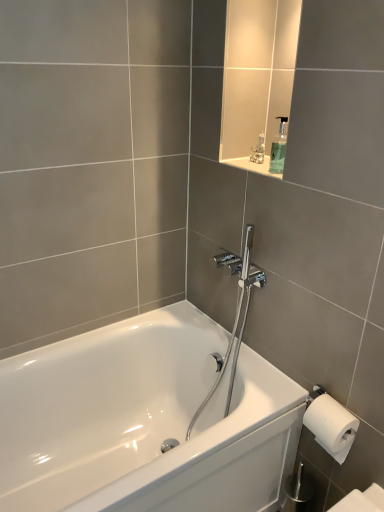
Image resolution: width=384 pixels, height=512 pixels. What do you see at coordinates (144, 421) in the screenshot?
I see `white glossy bathtub at center` at bounding box center [144, 421].

The image size is (384, 512). What do you see at coordinates (258, 150) in the screenshot?
I see `metallic silver figurine at upper center` at bounding box center [258, 150].

Where is `metallic silver figurine at upper center`? Image resolution: width=384 pixels, height=512 pixels. metallic silver figurine at upper center is located at coordinates (258, 150).

Locate an element on the screen. This screenshot has height=512, width=384. transparent plastic soap dispenser at upper center is located at coordinates (278, 149).

At what (x,y) coordinates should I click in order to perform the action: click on white glossy bathtub at center. Please return your answer as a coordinate pair (x, y). Looking at the image, I should click on (144, 421).

Is metallic silver figurine at upper center a part of transparent plastic soap dispenser at upper center?

No, metallic silver figurine at upper center is not inside transparent plastic soap dispenser at upper center.

In the image, is transparent plastic soap dispenser at upper center positioned in front of or behind metallic silver figurine at upper center?

In the image, transparent plastic soap dispenser at upper center appears in front of metallic silver figurine at upper center.

Could you tell me if transparent plastic soap dispenser at upper center is turned towards metallic silver figurine at upper center?

No, transparent plastic soap dispenser at upper center is not turned towards metallic silver figurine at upper center.

In order to click on soap dispenser that appears on the right of metallic silver figurine at upper center in this screenshot , I will do `click(278, 149)`.

Is metallic silver figurine at upper center looking in the opposite direction of transparent plastic soap dispenser at upper center?

metallic silver figurine at upper center is not turned away from transparent plastic soap dispenser at upper center.

Is transparent plastic soap dispenser at upper center inside metallic silver figurine at upper center?

Actually, transparent plastic soap dispenser at upper center is outside metallic silver figurine at upper center.

Considering the relative sizes of metallic silver figurine at upper center and transparent plastic soap dispenser at upper center in the image provided, is metallic silver figurine at upper center shorter than transparent plastic soap dispenser at upper center?

Correct, metallic silver figurine at upper center is not as tall as transparent plastic soap dispenser at upper center.

Considering the positions of point (261, 141) and point (275, 117), is point (261, 141) closer or farther from the camera than point (275, 117)?

Point (261, 141) is farther from the camera than point (275, 117).

Would you say polished chrome shower head at center is inside or outside white glossy bathtub at center?

polished chrome shower head at center is enclosed within white glossy bathtub at center.

Where is `bathtub that appears on the left of polished chrome shower head at center`? bathtub that appears on the left of polished chrome shower head at center is located at coordinates (144, 421).

Is polished chrome shower head at center wider or thinner than white glossy bathtub at center?

polished chrome shower head at center is thinner than white glossy bathtub at center.

Does metallic silver figurine at upper center appear on the left side of polished chrome shower head at center?

Incorrect, metallic silver figurine at upper center is not on the left side of polished chrome shower head at center.

Is metallic silver figurine at upper center next to polished chrome shower head at center and touching it?

No, metallic silver figurine at upper center is not next to polished chrome shower head at center.

Does metallic silver figurine at upper center come behind polished chrome shower head at center?

Yes, it is.

From the image's perspective, is metallic silver figurine at upper center located above or below polished chrome shower head at center?

metallic silver figurine at upper center is above polished chrome shower head at center.

From a real-world perspective, is transparent plastic soap dispenser at upper center physically above polished chrome shower head at center?

Yes, from a real-world perspective, transparent plastic soap dispenser at upper center is over polished chrome shower head at center

Considering the relative sizes of transparent plastic soap dispenser at upper center and polished chrome shower head at center in the image provided, is transparent plastic soap dispenser at upper center shorter than polished chrome shower head at center?

Indeed, transparent plastic soap dispenser at upper center has a lesser height compared to polished chrome shower head at center.

Is transparent plastic soap dispenser at upper center facing away from polished chrome shower head at center?

transparent plastic soap dispenser at upper center is not turned away from polished chrome shower head at center.

Is transparent plastic soap dispenser at upper center in front of polished chrome shower head at center?

No, it is not.

Is polished chrome shower head at center facing away from metallic silver figurine at upper center?

No, metallic silver figurine at upper center is not at the back of polished chrome shower head at center.

From the image's perspective, is polished chrome shower head at center above or below metallic silver figurine at upper center?

polished chrome shower head at center is situated lower than metallic silver figurine at upper center in the image.

In the scene shown: Who is taller, polished chrome shower head at center or metallic silver figurine at upper center?

polished chrome shower head at center is taller.

Between polished chrome shower head at center and metallic silver figurine at upper center, which one has smaller size?

metallic silver figurine at upper center is smaller.

Does polished chrome shower head at center have a larger size compared to transparent plastic soap dispenser at upper center?

Correct, polished chrome shower head at center is larger in size than transparent plastic soap dispenser at upper center.

Can you confirm if polished chrome shower head at center is taller than transparent plastic soap dispenser at upper center?

Yes.

You are a GUI agent. You are given a task and a screenshot of the screen. Output one action in this format:
    pyautogui.click(x=<x>, y=<y>)
    Task: Click on the soap dispenser behind the polished chrome shower head at center
    The height and width of the screenshot is (512, 384).
    Given the screenshot: What is the action you would take?
    pyautogui.click(x=278, y=149)

Which is closer, (247,306) or (276,148)?

Point (247,306) is farther from the camera than point (276,148).

Identify the location of soap dispenser above the metallic silver figurine at upper center (from a real-world perspective). (278, 149).

Find the location of a particular element. This screenshot has height=512, width=384. soap dispenser in front of the metallic silver figurine at upper center is located at coordinates (278, 149).

From the image, which object appears to be nearer to transparent plastic soap dispenser at upper center, white glossy bathtub at center or metallic silver figurine at upper center?

metallic silver figurine at upper center is closer to transparent plastic soap dispenser at upper center.

Considering their positions, is transparent plastic soap dispenser at upper center positioned closer to metallic silver figurine at upper center than white glossy bathtub at center?

transparent plastic soap dispenser at upper center is positioned closer to the anchor metallic silver figurine at upper center.

Based on the photo, looking at the image, which one is located closer to transparent plastic soap dispenser at upper center, polished chrome shower head at center or white glossy bathtub at center?

polished chrome shower head at center is positioned closer to the anchor transparent plastic soap dispenser at upper center.

Considering their positions, is white glossy bathtub at center positioned closer to transparent plastic soap dispenser at upper center than polished chrome shower head at center?

Based on the image, polished chrome shower head at center appears to be nearer to transparent plastic soap dispenser at upper center.

Considering their positions, is transparent plastic soap dispenser at upper center positioned closer to polished chrome shower head at center than white glossy bathtub at center?

white glossy bathtub at center is closer to polished chrome shower head at center.

Considering their positions, is polished chrome shower head at center positioned further to white glossy bathtub at center than transparent plastic soap dispenser at upper center?

transparent plastic soap dispenser at upper center.

From the picture: Estimate the real-world distances between objects in this image. Which object is further from metallic silver figurine at upper center, polished chrome shower head at center or white glossy bathtub at center?

white glossy bathtub at center is positioned further to the anchor metallic silver figurine at upper center.

Based on their spatial positions, is metallic silver figurine at upper center or polished chrome shower head at center further from white glossy bathtub at center?

metallic silver figurine at upper center is positioned further to the anchor white glossy bathtub at center.

The image size is (384, 512). Identify the location of soap dispenser that lies between metallic silver figurine at upper center and polished chrome shower head at center from top to bottom. (278, 149).

The height and width of the screenshot is (512, 384). I want to click on shower between metallic silver figurine at upper center and white glossy bathtub at center in the up-down direction, so click(x=236, y=311).

Find the location of a particular element. The height and width of the screenshot is (512, 384). shower between transparent plastic soap dispenser at upper center and white glossy bathtub at center vertically is located at coordinates (236, 311).

The width and height of the screenshot is (384, 512). I want to click on soap dispenser between metallic silver figurine at upper center and white glossy bathtub at center from top to bottom, so click(278, 149).